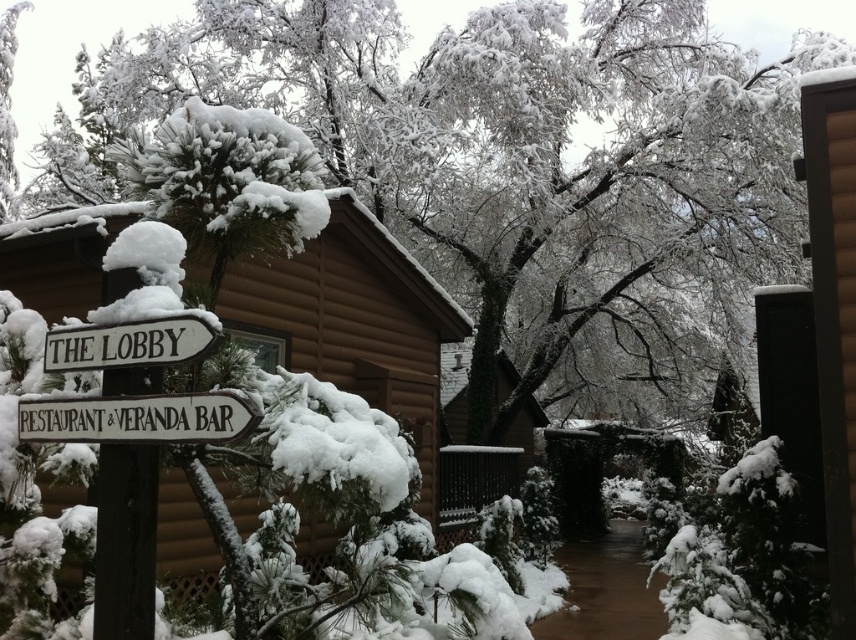
Who is shorter, white wood signpost at left or wooden sign at center?

Standing shorter between the two is wooden sign at center.

Is white wood signpost at left to the right of wooden sign at center from the viewer's perspective?

Indeed, white wood signpost at left is positioned on the right side of wooden sign at center.

Locate an element on the screen. white wood signpost at left is located at coordinates (125, 541).

Can you confirm if white wooden sign at center is positioned above wooden sign at center?

Actually, white wooden sign at center is below wooden sign at center.

Does white wooden sign at center appear on the right side of wooden sign at center?

Yes, white wooden sign at center is to the right of wooden sign at center.

I want to click on white wooden sign at center, so click(138, 419).

Does point (103, 564) come behind point (233, 419)?

That is True.

Locate an element on the screen. The image size is (856, 640). white wood signpost at left is located at coordinates (125, 541).